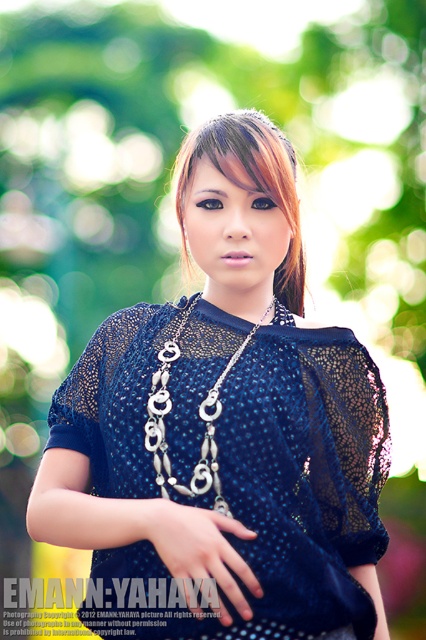
Question: Based on their relative distances, which object is farther from the matte blue blouse at center?

Choices:
 (A) silver metallic chain at center
 (B) brown shiny hair at center

Answer: (B)

Question: Does matte blue blouse at center appear on the right side of silver metallic chain at center?

Choices:
 (A) no
 (B) yes

Answer: (B)

Question: Which of the following is the closest to the observer?

Choices:
 (A) silver metallic chain at center
 (B) matte blue blouse at center
 (C) brown shiny hair at center

Answer: (B)

Question: Does matte blue blouse at center appear over silver metallic chain at center?

Choices:
 (A) yes
 (B) no

Answer: (A)

Question: Based on their relative distances, which object is nearer to the brown shiny hair at center?

Choices:
 (A) matte blue blouse at center
 (B) silver metallic chain at center

Answer: (A)

Question: Is matte blue blouse at center to the left of silver metallic chain at center from the viewer's perspective?

Choices:
 (A) no
 (B) yes

Answer: (A)